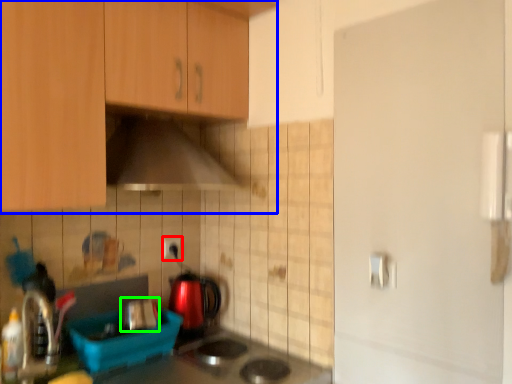
Question: Considering the real-world distances, which object is closest to electric outlet (highlighted by a red box)? cabinetry (highlighted by a blue box) or appliance (highlighted by a green box).

Choices:
 (A) cabinetry
 (B) appliance

Answer: (B)